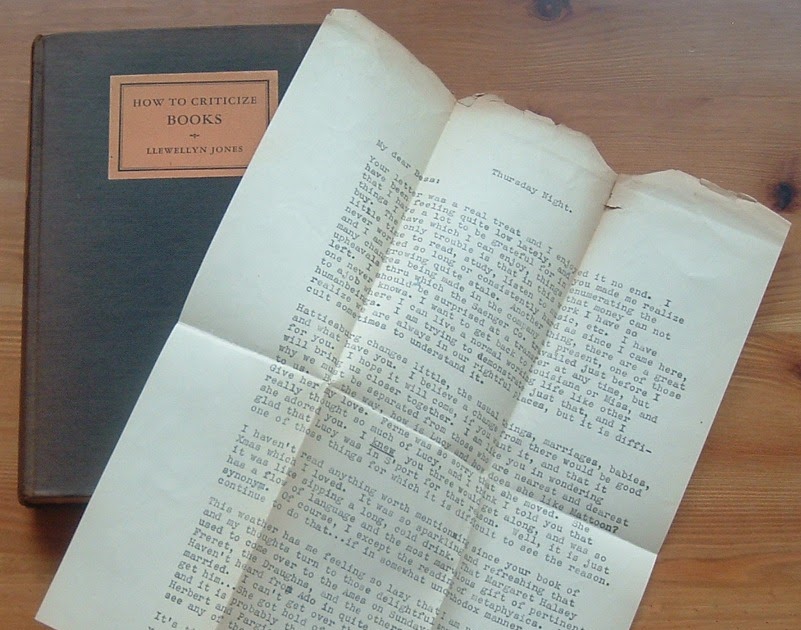
Locate an element on the screen. book hardcover is located at coordinates (106, 282).